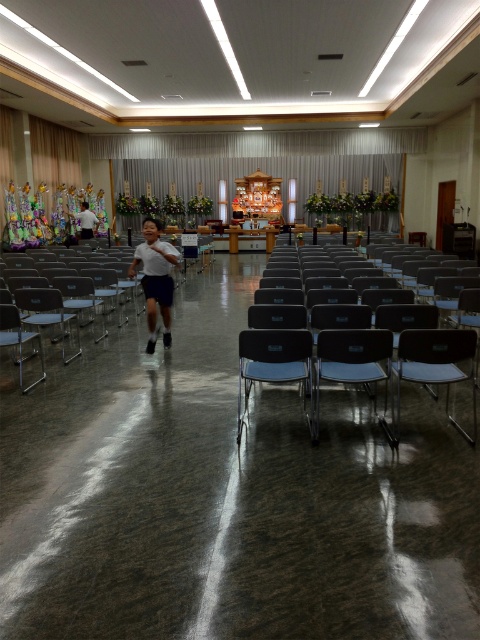
What do you see at coordinates (392, 364) in the screenshot? This screenshot has width=480, height=640. I see `matte plastic chair at center` at bounding box center [392, 364].

Can you confirm if matte plastic chair at center is shorter than metallic blue chair at center?

No, matte plastic chair at center is not shorter than metallic blue chair at center.

Identify the location of matte plastic chair at center. (392, 364).

Who is more forward, (x=428, y=356) or (x=326, y=342)?

Point (x=428, y=356) is more forward.

Does metallic blue chair at center lie behind matte gray chair at center?

No, it is not.

Is point (454, 339) positioned behind point (377, 362)?

No, it is not.

Where is `metallic blue chair at center`? The image size is (480, 640). metallic blue chair at center is located at coordinates (435, 364).

Image resolution: width=480 pixels, height=640 pixels. What do you see at coordinates (392, 364) in the screenshot? I see `matte plastic chair at center` at bounding box center [392, 364].

Is matte plastic chair at center wider than matte gray chair at center?

Indeed, matte plastic chair at center has a greater width compared to matte gray chair at center.

Between point (368, 349) and point (349, 356), which one is positioned behind?

The point (349, 356) is behind.

Locate an element on the screen. Image resolution: width=480 pixels, height=640 pixels. matte plastic chair at center is located at coordinates (392, 364).